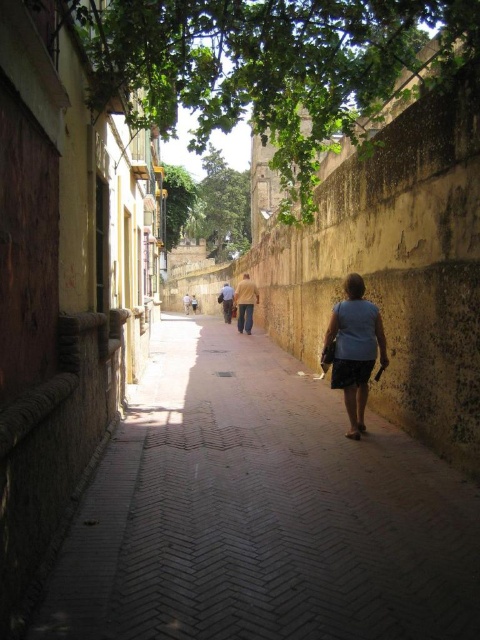
Between point (323, 573) and point (372, 356), which one is positioned in front?

Point (323, 573)

Does point (356, 508) come closer to viewer compared to point (345, 371)?

Yes, point (356, 508) is closer to viewer.

This screenshot has height=640, width=480. I want to click on brick paved walkway at center, so click(261, 513).